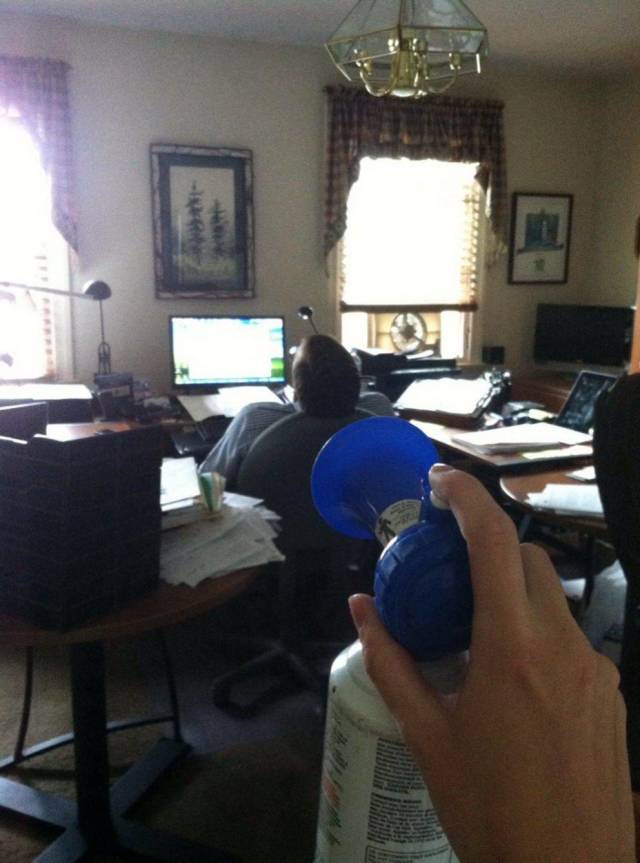
Where is `sleeping person on office chair`? This screenshot has width=640, height=863. sleeping person on office chair is located at coordinates (336, 391).